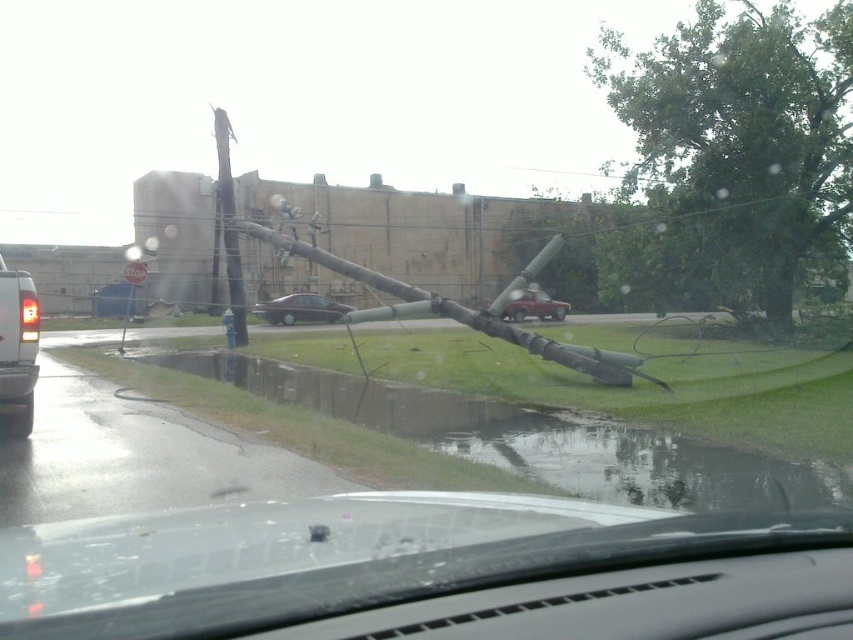
You are a delivery driver who needs to pass through the road blocked by the large utility pole. You see a matte silver van at left and a matte red truck at center. Which vehicle should you avoid to create more space for your delivery truck?

You should avoid the matte silver van at left because it occupies less space than the matte red truck at center, so removing it would free up more space for your delivery truck.

You are driving a car and see two points on the road ahead. The first point is at coordinate point(24, 371) and the second is at point(302, 312). Which point is closer to your current position?

Point(24, 371) is in front of point(302, 312), so it is closer to your current position.

You are a passenger in the dark gray matte sedan at center and notice a large fallen utility pole blocking the road ahead. The matte red truck at center is behind your vehicle. Can you safely exit your vehicle through the passenger side door without obstructing the truck?

The matte red truck at center is behind the dark gray matte sedan at center, so exiting through the passenger side door might not obstruct the truck since it is positioned behind the sedan. However, you should check the surrounding area for safety before exiting.